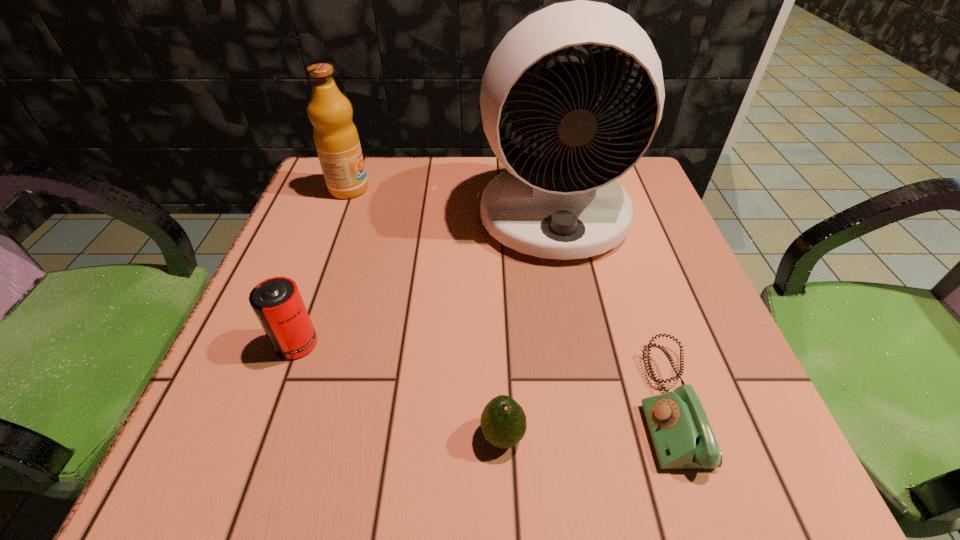
The height and width of the screenshot is (540, 960). What are the coordinates of `vacant area that lies between the avocado and the fan` in the screenshot? It's located at (528, 326).

You are a GUI agent. You are given a task and a screenshot of the screen. Output one action in this format:
    pyautogui.click(x=<x>, y=<y>)
    Task: Click on the free spot between the shortest object and the fruit juice
    The height and width of the screenshot is (540, 960).
    Given the screenshot: What is the action you would take?
    pyautogui.click(x=509, y=296)

Find the location of `vacant region between the third shortest object and the fruit juice`. vacant region between the third shortest object and the fruit juice is located at coordinates (323, 266).

At what (x,y) coordinates should I click in order to perform the action: click on free space between the second tallest object and the fourth tallest object. Please return your answer as a coordinate pair (x, y). Image resolution: width=960 pixels, height=540 pixels. Looking at the image, I should click on (425, 312).

The width and height of the screenshot is (960, 540). What are the coordinates of `vacant area that lies between the avocado and the telephone` in the screenshot? It's located at (586, 420).

At what (x,y) coordinates should I click in order to perform the action: click on unoccupied area between the fourth tallest object and the third shortest object. Please return your answer as a coordinate pair (x, y). The height and width of the screenshot is (540, 960). Looking at the image, I should click on (399, 390).

The height and width of the screenshot is (540, 960). Find the location of `vacant space that is in between the telephone and the second tallest object`. vacant space that is in between the telephone and the second tallest object is located at coordinates (509, 296).

Locate an element on the screen. The height and width of the screenshot is (540, 960). vacant space in between the shortest object and the can is located at coordinates (483, 373).

Where is `free space between the telephone and the third tallest object`? The height and width of the screenshot is (540, 960). free space between the telephone and the third tallest object is located at coordinates (483, 373).

At what (x,y) coordinates should I click in order to perform the action: click on object that stands as the third closest to the telephone. Please return your answer as a coordinate pair (x, y). This screenshot has height=540, width=960. Looking at the image, I should click on (277, 303).